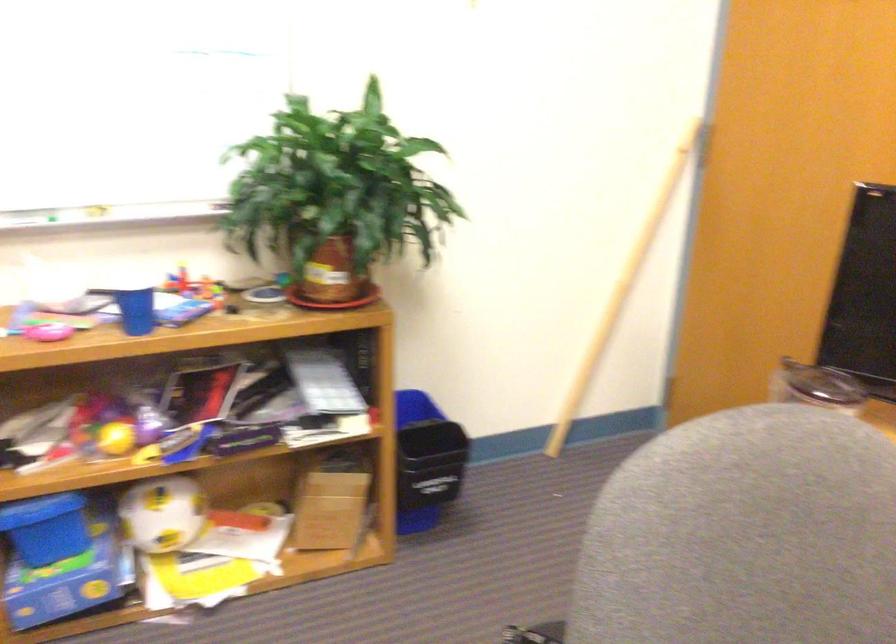
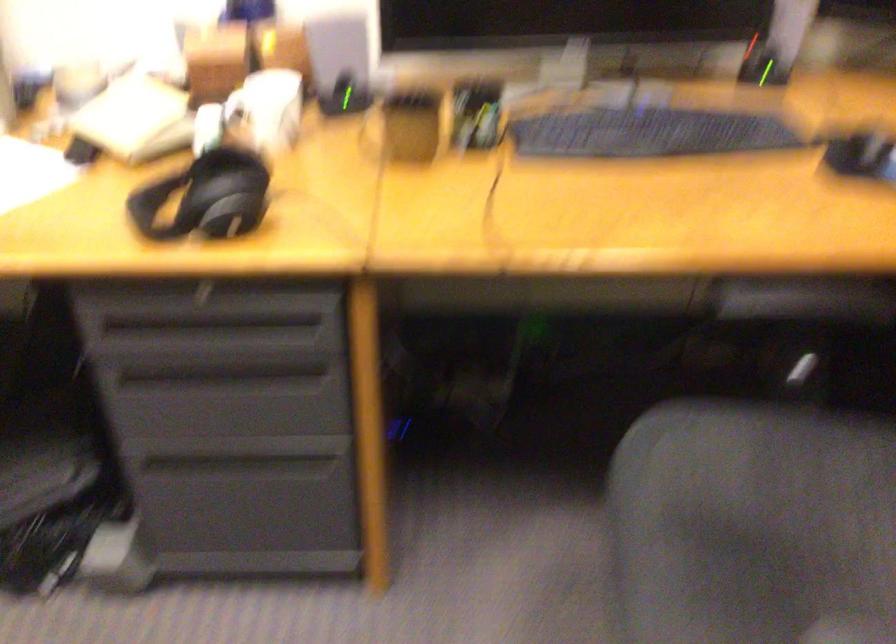
In the scene shown: How did the camera likely rotate?

The camera rotated toward right-down.